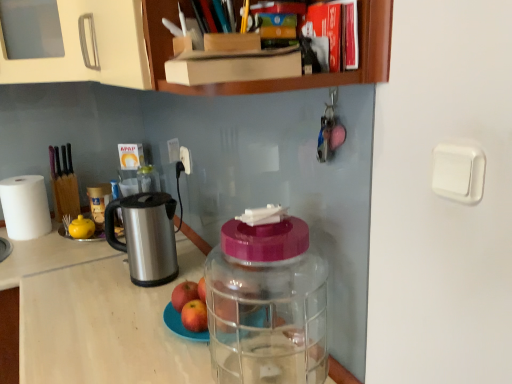
This screenshot has width=512, height=384. Identify the location of free space on the front side of stainless steel electric kettle at left. (124, 306).